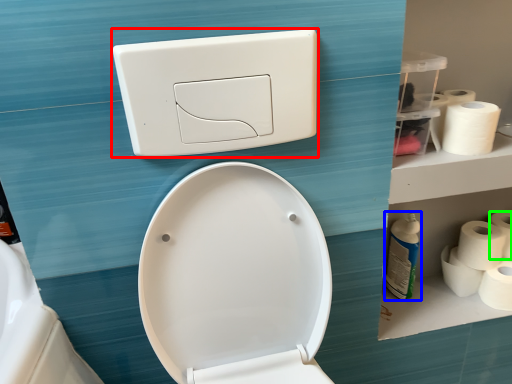
Question: Considering the real-world distances, which object is farthest from light switch (highlighted by a red box)? cleaning product (highlighted by a blue box) or toilet paper (highlighted by a green box)?

Choices:
 (A) cleaning product
 (B) toilet paper

Answer: (B)